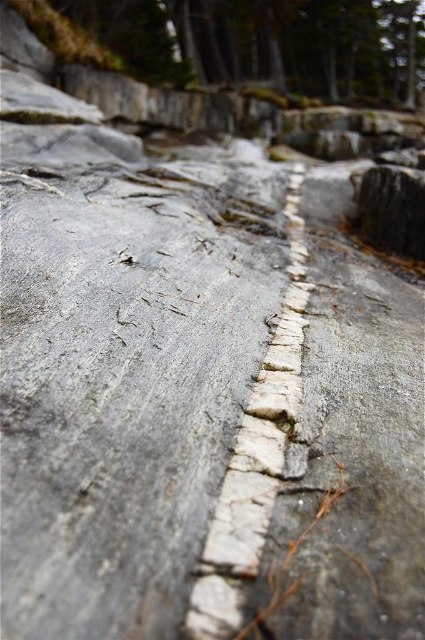
Question: Is smooth gray rock at upper center thinner than white stone line at center?

Choices:
 (A) yes
 (B) no

Answer: (B)

Question: Can you confirm if smooth gray rock at upper center is positioned to the right of white stone line at center?

Choices:
 (A) no
 (B) yes

Answer: (B)

Question: From the image, what is the correct spatial relationship of smooth gray rock at upper center in relation to white stone line at center?

Choices:
 (A) right
 (B) left

Answer: (A)

Question: Which point appears farthest from the camera in this image?

Choices:
 (A) (218, 61)
 (B) (187, 625)

Answer: (A)

Question: Which of the following is the closest to the observer?

Choices:
 (A) white stone line at center
 (B) smooth gray rock at upper center

Answer: (A)